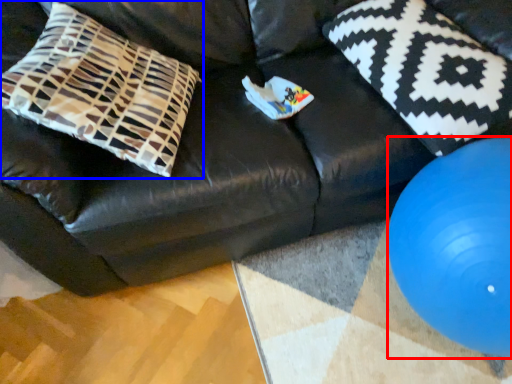
Question: Which of the following is the closest to the observer, ball (highlighted by a red box) or pillow (highlighted by a blue box)?

Choices:
 (A) ball
 (B) pillow

Answer: (A)